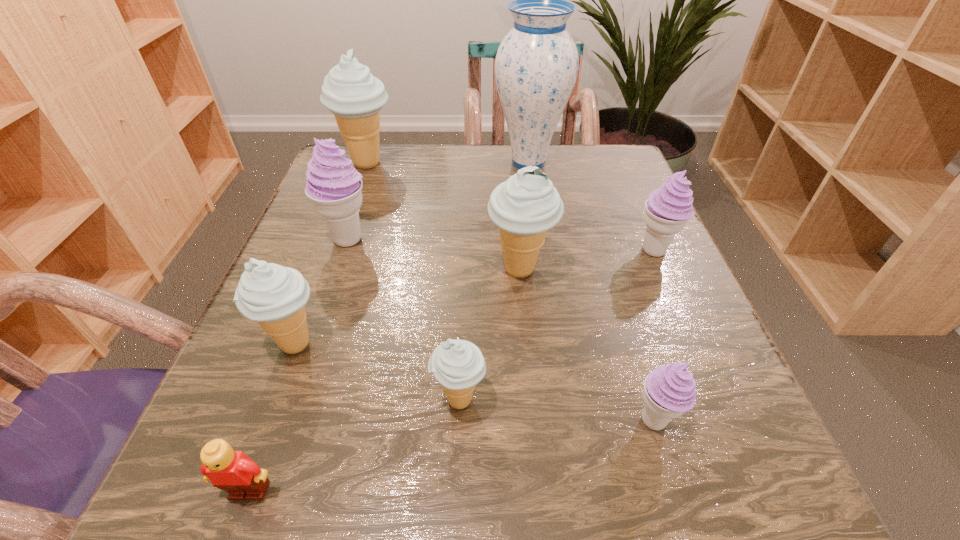
Locate an element on the screen. The height and width of the screenshot is (540, 960). vacant space located 0.210m on the right of the leftmost purple icecream is located at coordinates (484, 239).

Where is `vacant area located on the front of the second nearest beige icecream`? vacant area located on the front of the second nearest beige icecream is located at coordinates (252, 460).

Image resolution: width=960 pixels, height=540 pixels. Identify the location of vacant position located 0.220m on the left of the rightmost purple icecream. (516, 251).

I want to click on free spot located 0.080m on the left of the fourth icecream from left to right, so click(373, 400).

Find the location of a particular element. vacant space located 0.290m on the left of the second purple icecream from right to left is located at coordinates (410, 421).

Where is `vase that is positioned at the far edge`? The image size is (960, 540). vase that is positioned at the far edge is located at coordinates (536, 66).

This screenshot has height=540, width=960. I want to click on icecream situated at the far edge, so click(x=349, y=91).

The height and width of the screenshot is (540, 960). I want to click on object present at the near edge, so click(233, 471).

This screenshot has height=540, width=960. What are the coordinates of `Lego present at the left edge` in the screenshot? It's located at (233, 471).

At what (x,y) coordinates should I click in order to perform the action: click on vase located at the right edge. Please return your answer as a coordinate pair (x, y). The image size is (960, 540). Looking at the image, I should click on (536, 66).